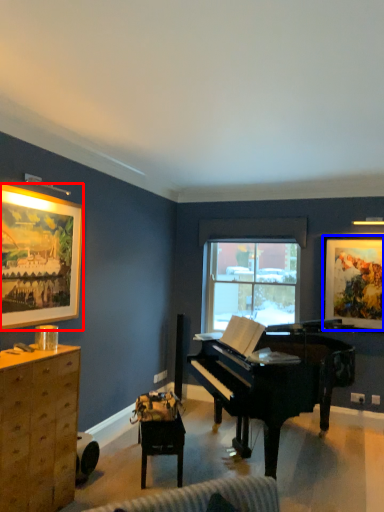
Question: Which point is further to the camera, picture frame (highlighted by a red box) or picture frame (highlighted by a blue box)?

Choices:
 (A) picture frame
 (B) picture frame

Answer: (B)